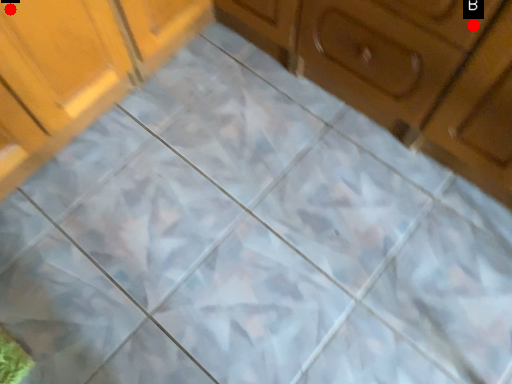
Question: Two points are circled on the image, labeled by A and B beside each circle. Which point is closer to the camera?

Choices:
 (A) A is closer
 (B) B is closer

Answer: (B)